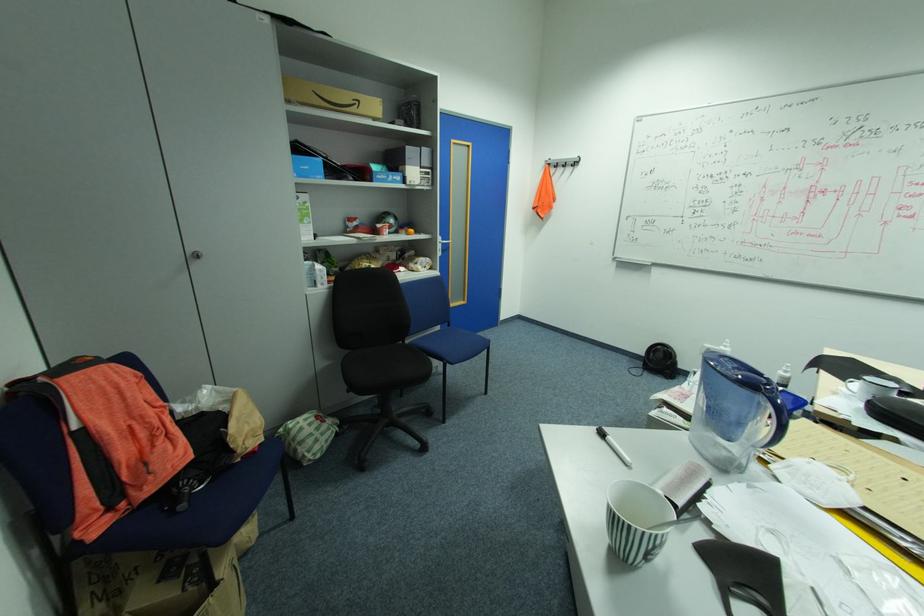
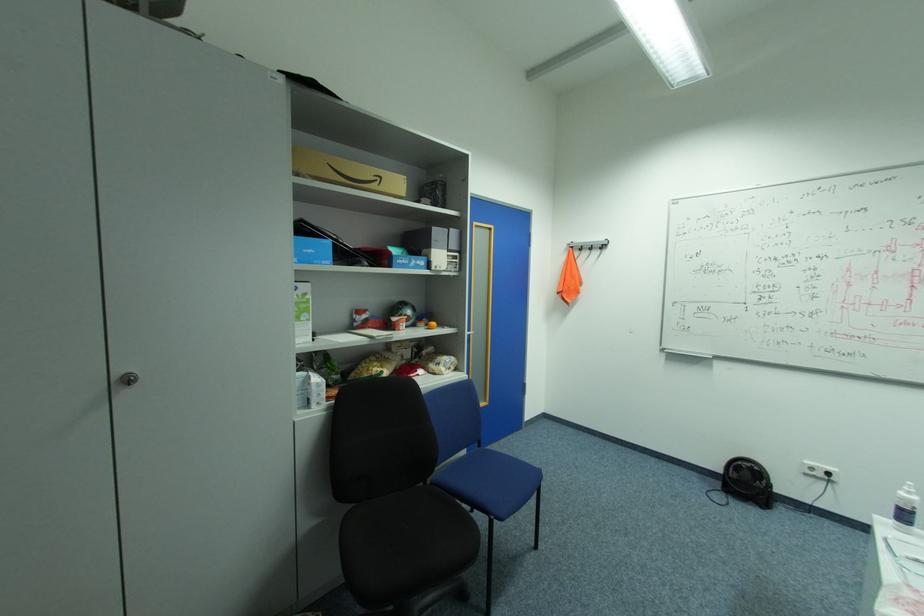
The point at (648, 363) is marked in the first image. Where is the corresponding point in the second image?

(724, 484)